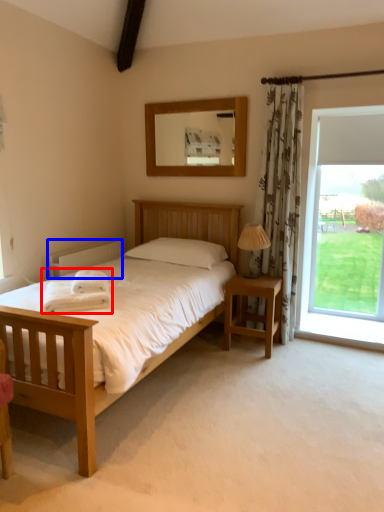
Question: Which object is further to the camera taking this photo, blanket (highlighted by a red box) or radiator (highlighted by a blue box)?

Choices:
 (A) blanket
 (B) radiator

Answer: (B)